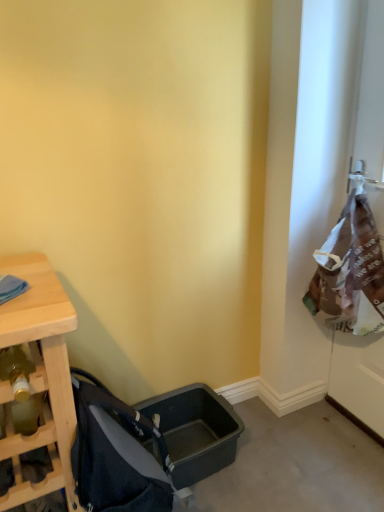
Image resolution: width=384 pixels, height=512 pixels. Describe the element at coordinates (359, 379) in the screenshot. I see `brown paper bag at right` at that location.

Locate an element on the screen. brown paper bag at right is located at coordinates (359, 379).

I want to click on dark gray fabric baby carriage at lower left, so click(116, 454).

What do you see at coordinates (116, 454) in the screenshot? The image size is (384, 512). I see `dark gray fabric baby carriage at lower left` at bounding box center [116, 454].

Image resolution: width=384 pixels, height=512 pixels. I want to click on brown paper bag at right, so click(x=359, y=379).

Based on their positions, is brown paper bag at right located to the left or right of dark gray fabric baby carriage at lower left?

In the image, brown paper bag at right appears on the right side of dark gray fabric baby carriage at lower left.

Considering the positions of objects brown paper bag at right and dark gray fabric baby carriage at lower left in the image provided, who is behind, brown paper bag at right or dark gray fabric baby carriage at lower left?

brown paper bag at right is further from the camera.

Is point (335, 333) closer or farther from the camera than point (100, 508)?

Point (335, 333) is positioned farther from the camera compared to point (100, 508).

From the image's perspective, which is above, brown paper bag at right or dark gray fabric baby carriage at lower left?

brown paper bag at right is shown above in the image.

From a real-world perspective, is brown paper bag at right positioned above or below dark gray fabric baby carriage at lower left?

From a real-world perspective, brown paper bag at right is physically above dark gray fabric baby carriage at lower left.

Which object is wider, brown paper bag at right or dark gray fabric baby carriage at lower left?

A: dark gray fabric baby carriage at lower left is wider.

Considering the sizes of brown paper bag at right and dark gray fabric baby carriage at lower left in the image, is brown paper bag at right taller or shorter than dark gray fabric baby carriage at lower left?

brown paper bag at right is taller than dark gray fabric baby carriage at lower left.

Considering the sizes of objects brown paper bag at right and dark gray fabric baby carriage at lower left in the image provided, who is bigger, brown paper bag at right or dark gray fabric baby carriage at lower left?

brown paper bag at right is bigger.

Do you think brown paper bag at right is within dark gray fabric baby carriage at lower left, or outside of it?

brown paper bag at right is not enclosed by dark gray fabric baby carriage at lower left.

Would you consider brown paper bag at right to be distant from dark gray fabric baby carriage at lower left?

Actually, brown paper bag at right and dark gray fabric baby carriage at lower left are a little close together.

Is brown paper bag at right looking in the opposite direction of dark gray fabric baby carriage at lower left?

That's not correct — brown paper bag at right is not looking away from dark gray fabric baby carriage at lower left.

This screenshot has width=384, height=512. I want to click on baby carriage below the brown paper bag at right (from a real-world perspective), so point(116,454).

Between dark gray fabric baby carriage at lower left and brown paper bag at right, which one appears on the left side from the viewer's perspective?

dark gray fabric baby carriage at lower left.

Is dark gray fabric baby carriage at lower left in front of or behind brown paper bag at right in the image?

dark gray fabric baby carriage at lower left is positioned closer to the viewer than brown paper bag at right.

Does point (71, 377) appear closer or farther from the camera than point (383, 198)?

Clearly, point (71, 377) is closer to the camera than point (383, 198).

From the image's perspective, which one is positioned lower, dark gray fabric baby carriage at lower left or brown paper bag at right?

From the image's view, dark gray fabric baby carriage at lower left is below.

Based on the photo, from a real-world perspective, between dark gray fabric baby carriage at lower left and brown paper bag at right, who is vertically higher?

brown paper bag at right, from a real-world perspective.

Which of these two, dark gray fabric baby carriage at lower left or brown paper bag at right, is wider?

dark gray fabric baby carriage at lower left is wider.

Which of these two, dark gray fabric baby carriage at lower left or brown paper bag at right, stands taller?

Standing taller between the two is brown paper bag at right.

Considering the sizes of dark gray fabric baby carriage at lower left and brown paper bag at right in the image, is dark gray fabric baby carriage at lower left bigger or smaller than brown paper bag at right?

dark gray fabric baby carriage at lower left is smaller than brown paper bag at right.

Do you think dark gray fabric baby carriage at lower left is within brown paper bag at right, or outside of it?

dark gray fabric baby carriage at lower left is located beyond the bounds of brown paper bag at right.

Is dark gray fabric baby carriage at lower left in contact with brown paper bag at right?

No, dark gray fabric baby carriage at lower left is not making contact with brown paper bag at right.

Could you tell me if dark gray fabric baby carriage at lower left is turned towards brown paper bag at right?

Yes, dark gray fabric baby carriage at lower left is oriented towards brown paper bag at right.

Can you tell me how much dark gray fabric baby carriage at lower left and brown paper bag at right differ in facing direction?

The facing directions of dark gray fabric baby carriage at lower left and brown paper bag at right are 179 degrees apart.

How far apart are dark gray fabric baby carriage at lower left and brown paper bag at right?

Result: dark gray fabric baby carriage at lower left is 38.77 inches from brown paper bag at right.

Where is `baby carriage on the left of brown paper bag at right`? baby carriage on the left of brown paper bag at right is located at coordinates (116, 454).

The width and height of the screenshot is (384, 512). I want to click on baby carriage beneath the brown paper bag at right (from a real-world perspective), so click(x=116, y=454).

Where is `screen door on the right of dark gray fabric baby carriage at lower left`? The image size is (384, 512). screen door on the right of dark gray fabric baby carriage at lower left is located at coordinates (359, 379).